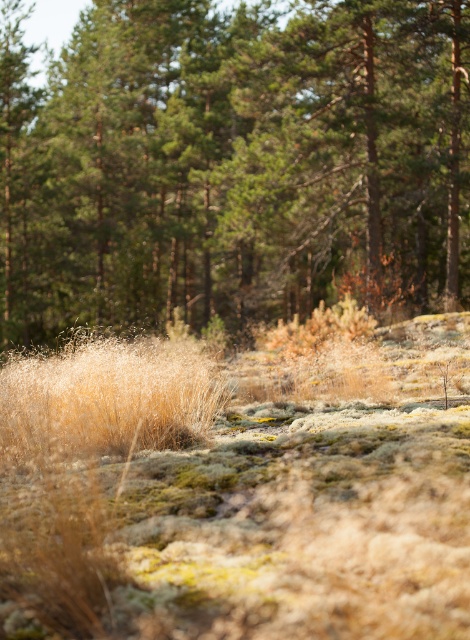
Question: Which point is closer to the camera?

Choices:
 (A) green textured pine forest at center
 (B) dry grass at lower left

Answer: (B)

Question: Does green textured pine forest at center have a greater width compared to dry grass at lower left?

Choices:
 (A) no
 (B) yes

Answer: (B)

Question: Is green textured pine forest at center smaller than dry grass at lower left?

Choices:
 (A) yes
 (B) no

Answer: (B)

Question: Which point is closer to the camera taking this photo?

Choices:
 (A) (164, 435)
 (B) (219, 257)

Answer: (A)

Question: Can you confirm if green textured pine forest at center is smaller than dry grass at lower left?

Choices:
 (A) no
 (B) yes

Answer: (A)